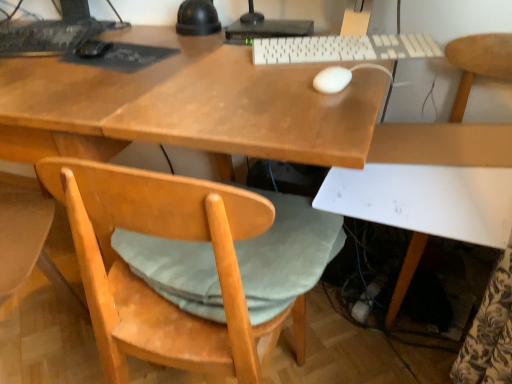
Locate an element on the screen. This screenshot has width=512, height=384. free region on the left part of white plastic desktop computer at upper center is located at coordinates (197, 37).